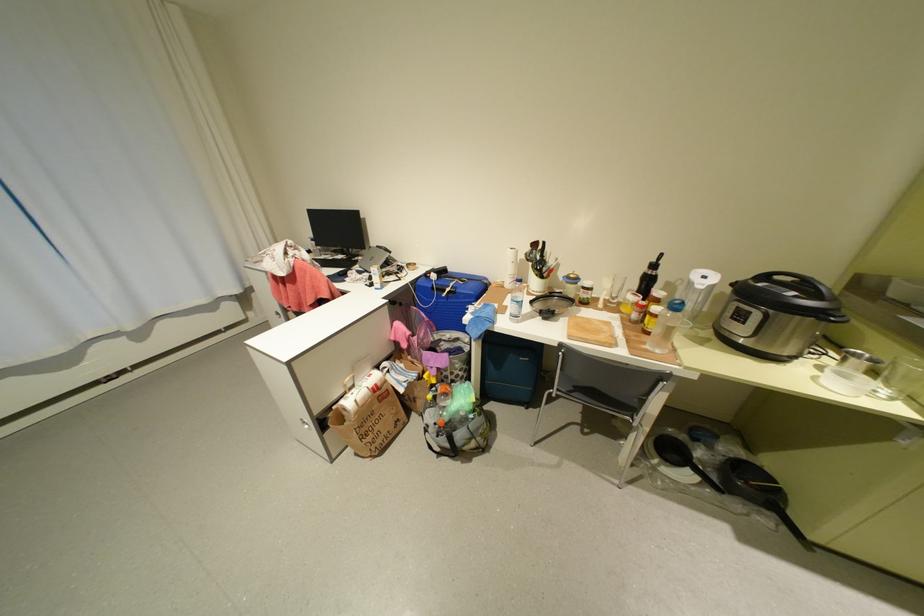
Find the location of `clear plastic bottle`. clear plastic bottle is located at coordinates (665, 326).